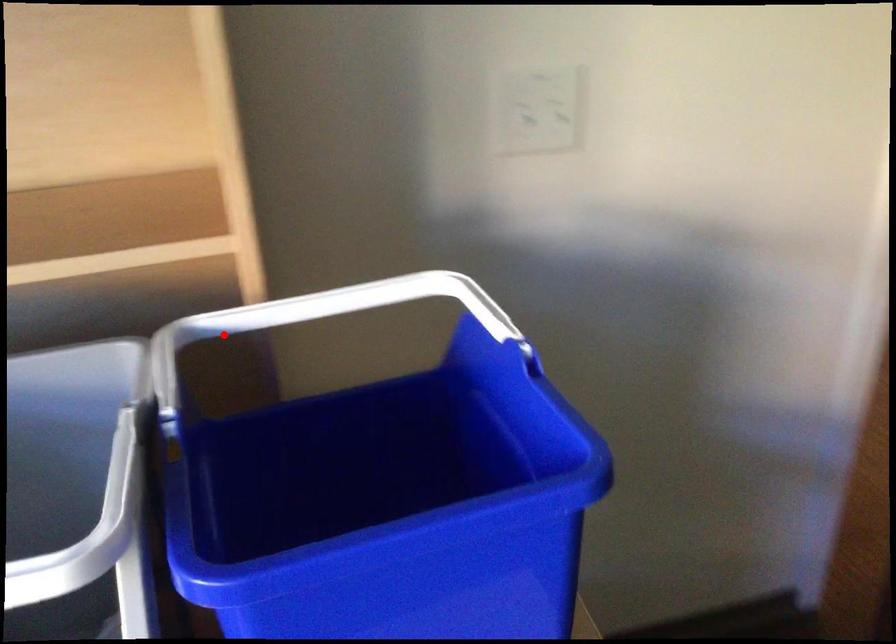
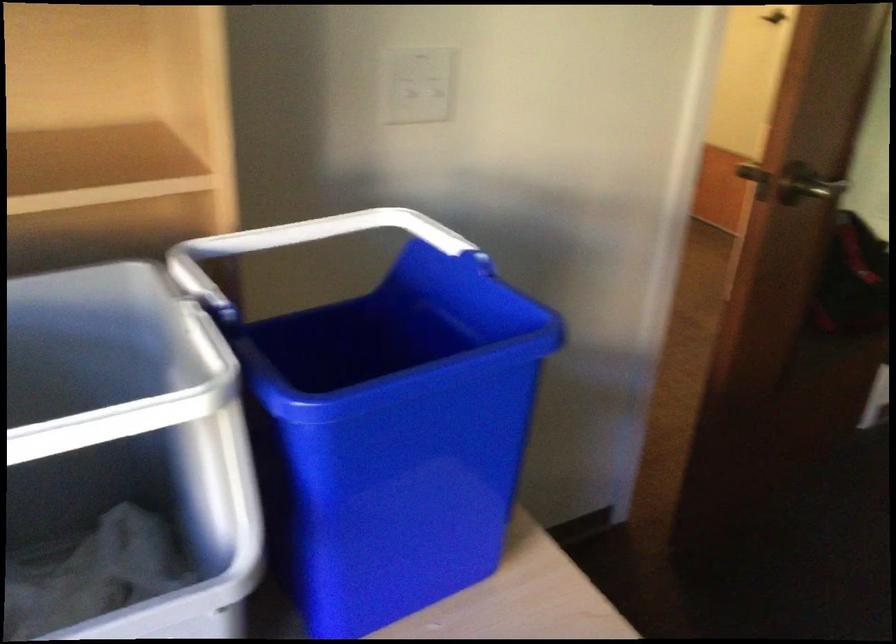
In the second image, find the point that corresponds to the highlighted location in the first image.

(213, 257)